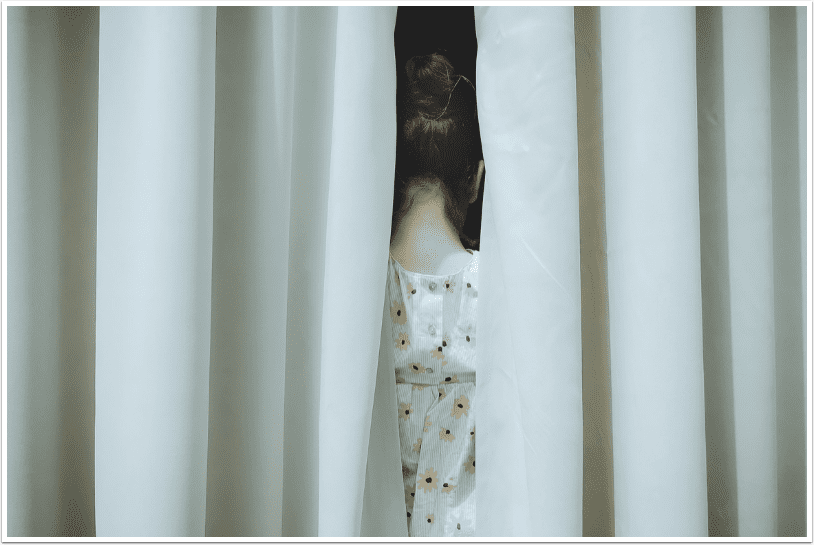
Where is `curtain on left`? This screenshot has width=814, height=545. curtain on left is located at coordinates (346, 373).